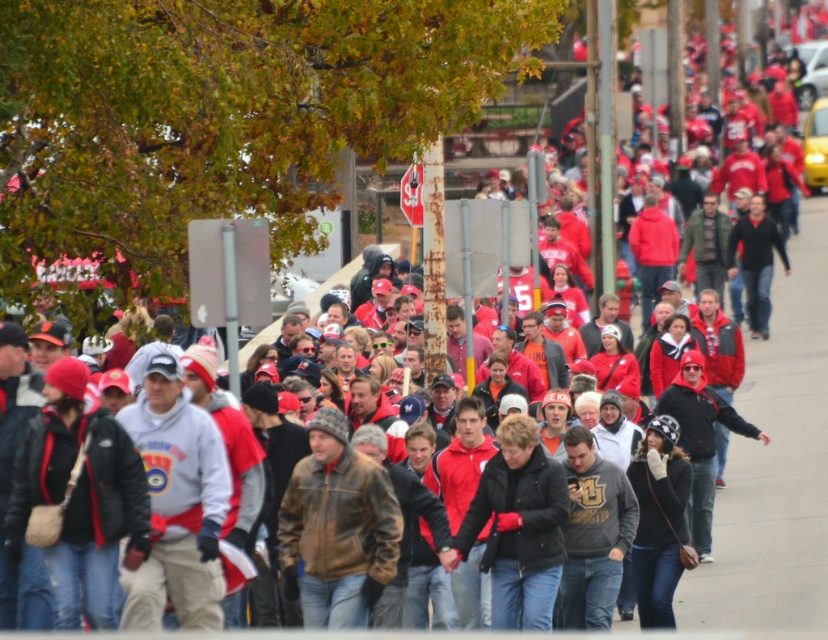
You are a photographer trying to capture a photo of both the matte black jacket at center and the brown leather jacket at center. Since you want them both in frame, which jacket should you position your camera closer to?

You should position your camera closer to the matte black jacket at center because it is to the left of the brown leather jacket at center, so moving closer to it will keep both jackets within the frame.